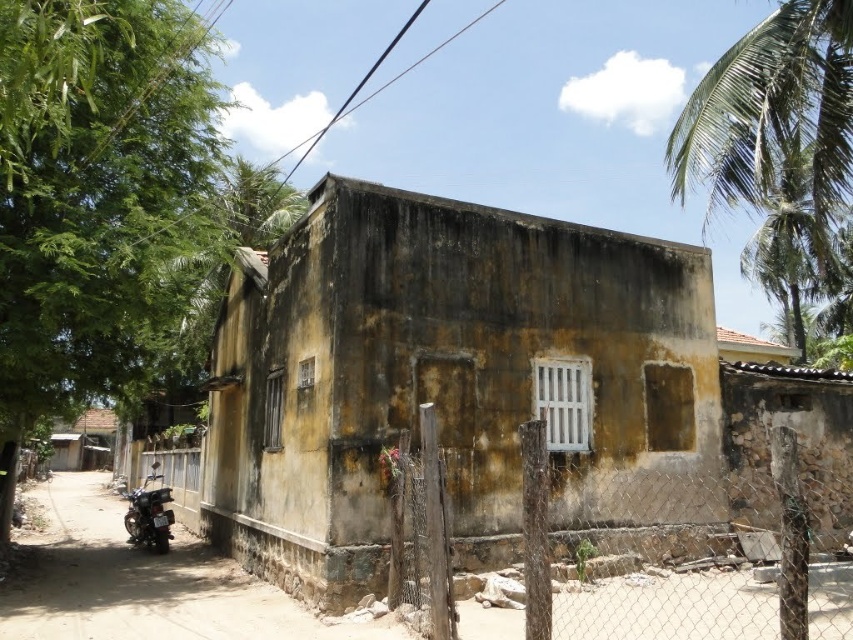
Question: Which point appears farthest from the camera in this image?

Choices:
 (A) (830, 596)
 (B) (732, 74)
 (C) (112, 600)
 (D) (128, 531)

Answer: (D)

Question: Is wooden post at center to the right of smooth concrete alley at lower left from the viewer's perspective?

Choices:
 (A) no
 (B) yes

Answer: (B)

Question: Which of the following is the farthest from the observer?

Choices:
 (A) (154, 241)
 (B) (155, 509)
 (C) (618, 618)

Answer: (B)

Question: Among these objects, which one is farthest from the camera?

Choices:
 (A) shiny black motorbike at lower left
 (B) smooth concrete alley at lower left

Answer: (A)

Question: In this image, where is green leafy tree at left located relative to green leafy palm tree at upper right?

Choices:
 (A) right
 (B) left

Answer: (B)

Question: Is wooden post at center further to camera compared to green leafy palm tree at upper right?

Choices:
 (A) no
 (B) yes

Answer: (A)